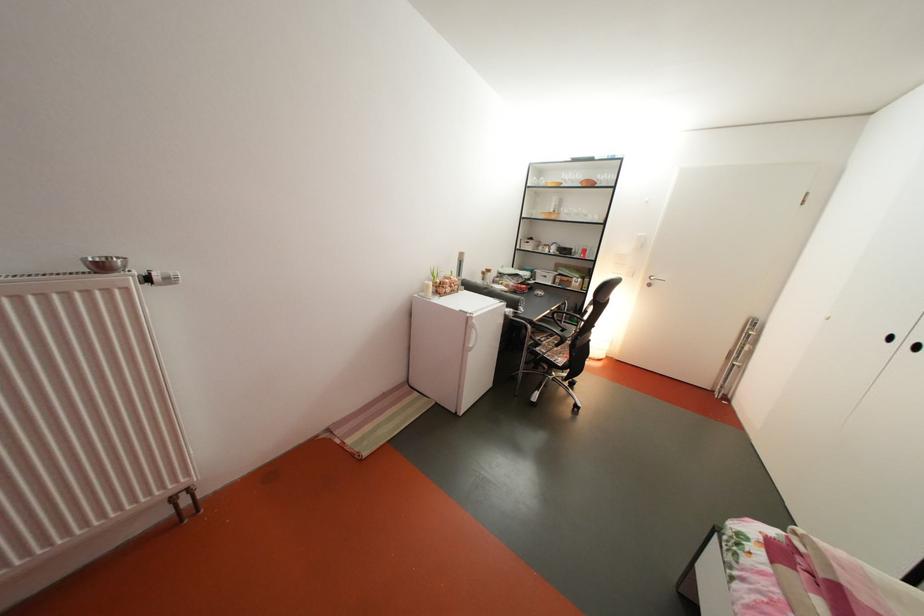
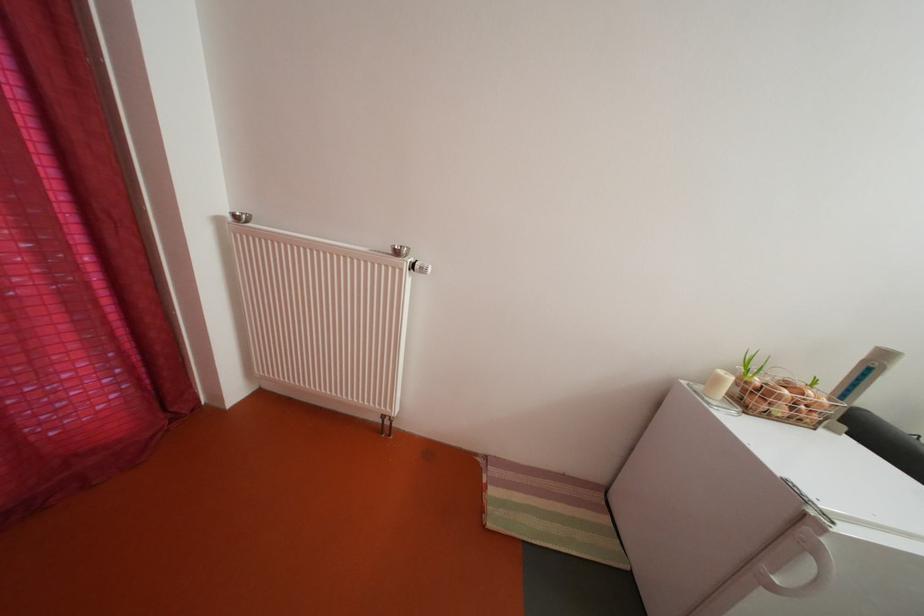
Question: The first image is from the beginning of the video and the second image is from the end. How did the camera likely rotate when shooting the video?

Choices:
 (A) Left
 (B) Right
 (C) Up
 (D) Down

Answer: (A)